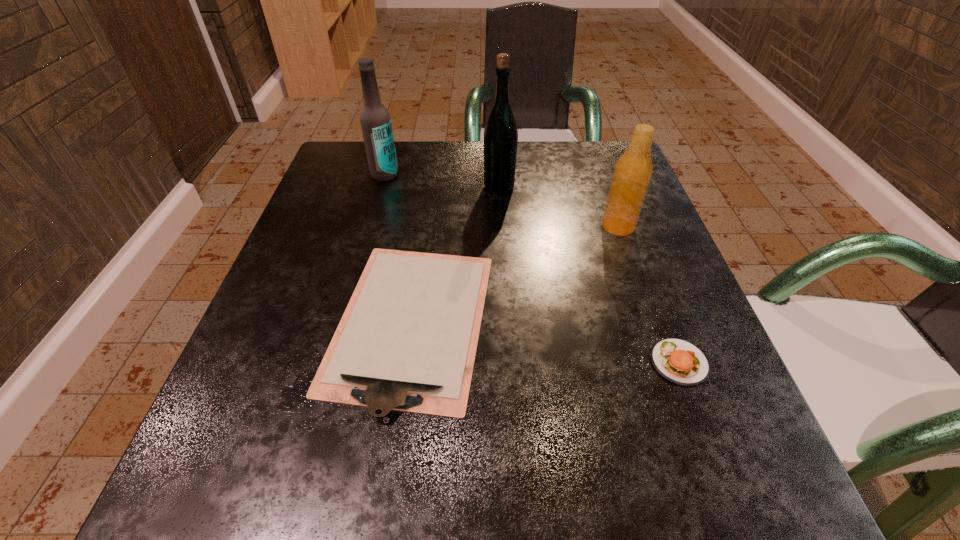
Where is `the second beer bottle from right to left`? the second beer bottle from right to left is located at coordinates (500, 133).

The height and width of the screenshot is (540, 960). I want to click on the leftmost beer bottle, so click(375, 120).

I want to click on the third nearest object, so pyautogui.click(x=632, y=173).

Where is `the shortest beer bottle`? the shortest beer bottle is located at coordinates (632, 173).

The image size is (960, 540). Find the location of `the second shortest object`. the second shortest object is located at coordinates (678, 361).

Identify the location of clipboard. The width and height of the screenshot is (960, 540). (407, 341).

Locate an element on the screen. free spot located 0.230m on the left of the second beer bottle from left to right is located at coordinates (378, 187).

I want to click on vacant space located 0.180m on the side of the leftmost beer bottle with the label, so click(x=368, y=234).

Find the location of a particular element. free space located 0.210m on the left of the third nearest object is located at coordinates (494, 226).

Image resolution: width=960 pixels, height=540 pixels. I want to click on vacant area situated on the back of the second shortest object, so click(614, 191).